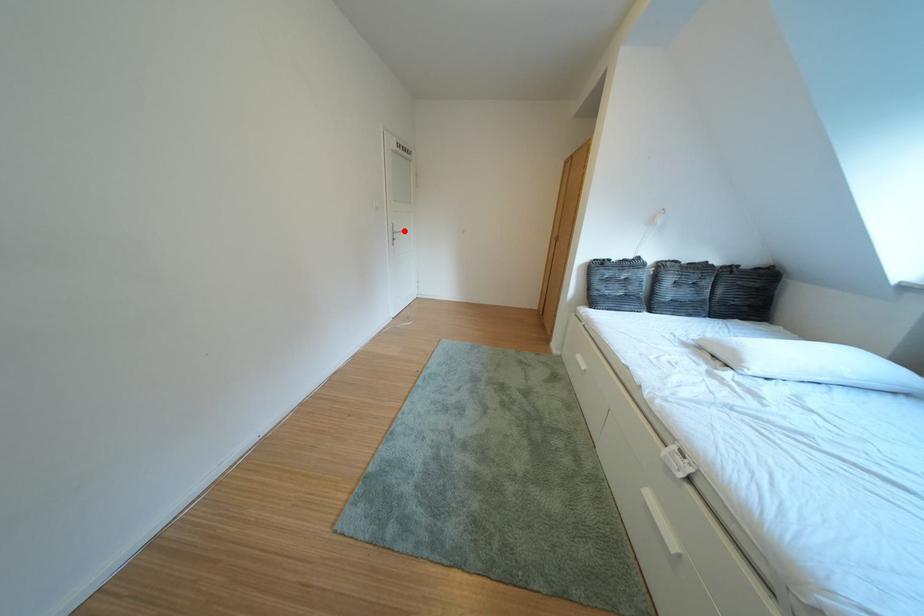
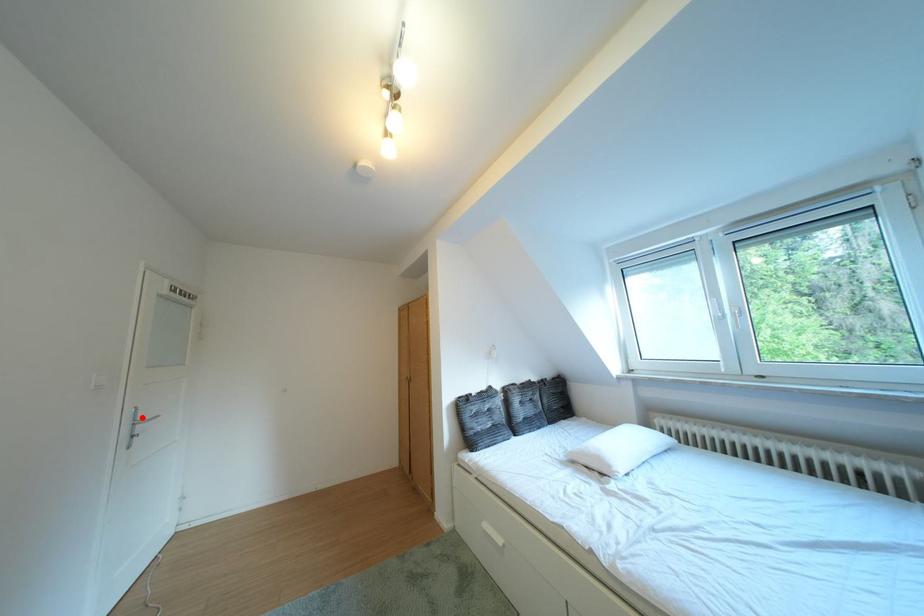
From the picture: I am providing you with two images of the same scene from different viewpoints. A red point is marked on the first image and another point is marked on the second image. Is the red point in image1 aligned with the point shown in image2?

Yes